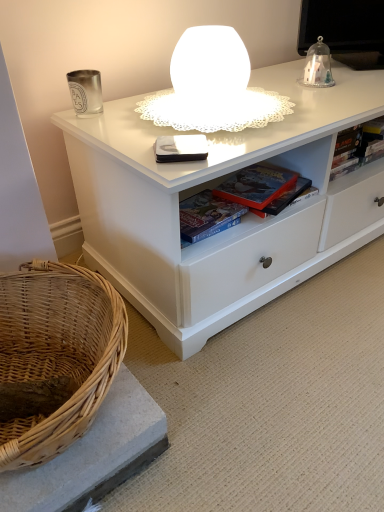
Question: Is the surface of hardcover book at upper right, which is the fourth book from left to right, in direct contact with matte plastic book at center, which is the third book from front to back?

Choices:
 (A) yes
 (B) no

Answer: (B)

Question: Does hardcover book at upper right, acting as the first book starting from the right, have a greater width compared to matte plastic book at center, acting as the 3th book starting from the left?

Choices:
 (A) no
 (B) yes

Answer: (A)

Question: Considering the relative positions of hardcover book at upper right, the first book positioned from the back, and matte plastic book at center, which is the third book from front to back, in the image provided, is hardcover book at upper right, the first book positioned from the back, to the right of matte plastic book at center, which is the third book from front to back, from the viewer's perspective?

Choices:
 (A) no
 (B) yes

Answer: (B)

Question: From a real-world perspective, is hardcover book at upper right, which is the fourth book from left to right, located higher than matte plastic book at center, marked as the second book in a right-to-left arrangement?

Choices:
 (A) no
 (B) yes

Answer: (B)

Question: Can you confirm if hardcover book at upper right, acting as the fourth book starting from the front, is positioned to the left of matte plastic book at center, the 2th book positioned from the back?

Choices:
 (A) yes
 (B) no

Answer: (B)

Question: From a real-world perspective, is white frosted glass table lamp at upper center physically located above or below matte board game at center, which is counted as the third book, starting from the right?

Choices:
 (A) below
 (B) above

Answer: (B)

Question: Choose the correct answer: Is white frosted glass table lamp at upper center inside matte board game at center, which is counted as the third book, starting from the right, or outside it?

Choices:
 (A) outside
 (B) inside

Answer: (A)

Question: Is white frosted glass table lamp at upper center in front of or behind matte board game at center, which is counted as the third book, starting from the right, in the image?

Choices:
 (A) behind
 (B) front

Answer: (B)

Question: Considering the positions of point (150, 95) and point (187, 220), is point (150, 95) closer or farther from the camera than point (187, 220)?

Choices:
 (A) farther
 (B) closer

Answer: (A)

Question: Does point (208, 226) appear closer or farther from the camera than point (193, 62)?

Choices:
 (A) closer
 (B) farther

Answer: (B)

Question: Looking at their shapes, would you say matte board game at center, which is counted as the third book, starting from the right, is wider or thinner than white frosted glass table lamp at upper center?

Choices:
 (A) wide
 (B) thin

Answer: (B)

Question: From a real-world perspective, is matte board game at center, which is counted as the third book, starting from the right, positioned above or below white frosted glass table lamp at upper center?

Choices:
 (A) below
 (B) above

Answer: (A)

Question: From the image's perspective, relative to white frosted glass table lamp at upper center, is matte board game at center, which ranks as the 3th book in back-to-front order, above or below?

Choices:
 (A) below
 (B) above

Answer: (A)

Question: Considering the positions of matte board game at center, which is counted as the third book, starting from the right, and hardcover book at upper right, the first book positioned from the back, in the image, is matte board game at center, which is counted as the third book, starting from the right, bigger or smaller than hardcover book at upper right, the first book positioned from the back,?

Choices:
 (A) big
 (B) small

Answer: (B)

Question: Is matte board game at center, which ranks as the 3th book in back-to-front order, inside the boundaries of hardcover book at upper right, acting as the first book starting from the right, or outside?

Choices:
 (A) outside
 (B) inside

Answer: (A)